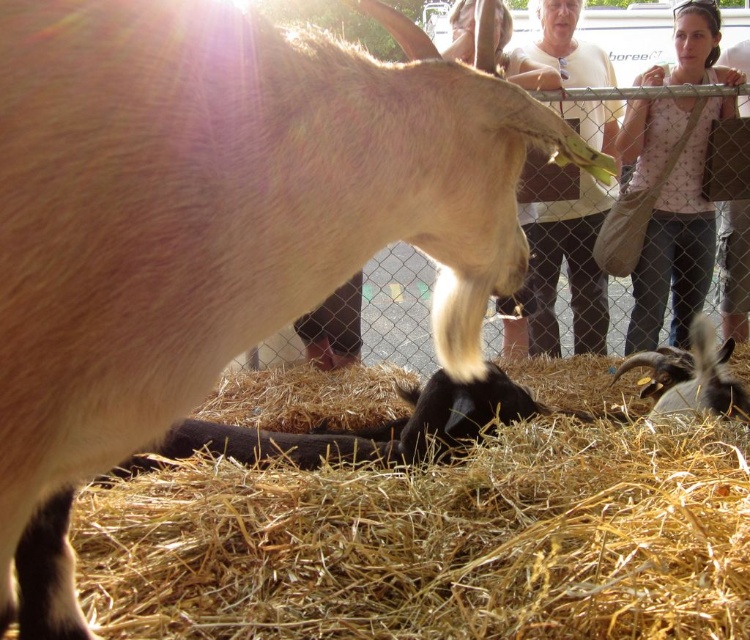
Question: Considering the relative positions of light beige sweater at upper center and black fuzzy goat at lower right in the image provided, where is light beige sweater at upper center located with respect to black fuzzy goat at lower right?

Choices:
 (A) below
 (B) above

Answer: (B)

Question: Which object is closer to the camera taking this photo?

Choices:
 (A) pink dotted shirt at upper right
 (B) golden straw at lower center
 (C) light beige sweater at upper center

Answer: (B)

Question: Does golden straw at lower center have a greater width compared to light beige sweater at upper center?

Choices:
 (A) yes
 (B) no

Answer: (A)

Question: Considering the real-world distances, which object is farthest from the golden straw at lower center?

Choices:
 (A) black fuzzy goat at lower right
 (B) pink dotted shirt at upper right

Answer: (B)

Question: Is pink dotted shirt at upper right below light beige sweater at upper center?

Choices:
 (A) yes
 (B) no

Answer: (A)

Question: Which of these objects is positioned farthest from the light beige sweater at upper center?

Choices:
 (A) black fuzzy goat at lower right
 (B) golden straw at lower center

Answer: (B)